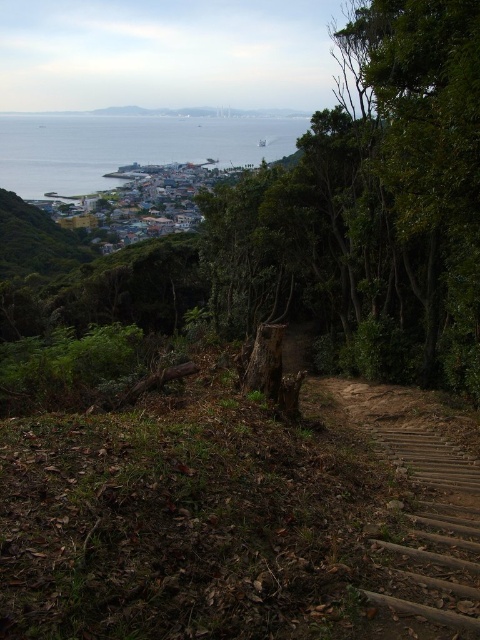
Question: Which point appears farthest from the camera in this image?

Choices:
 (A) (276, 157)
 (B) (446, 564)
 (C) (394, 0)

Answer: (A)

Question: Does green rough bark tree at center lie in front of blue water at center?

Choices:
 (A) yes
 (B) no

Answer: (A)

Question: Is blue water at center to the left of wooden stairs at lower right from the viewer's perspective?

Choices:
 (A) no
 (B) yes

Answer: (B)

Question: Which point is farther from the camera taking this photo?

Choices:
 (A) (54, 148)
 (B) (408, 333)

Answer: (A)

Question: Estimate the real-world distances between objects in this image. Which object is farther from the wooden stairs at lower right?

Choices:
 (A) green rough bark tree at center
 (B) blue water at center

Answer: (B)

Question: Is green rough bark tree at center in front of wooden stairs at lower right?

Choices:
 (A) yes
 (B) no

Answer: (B)